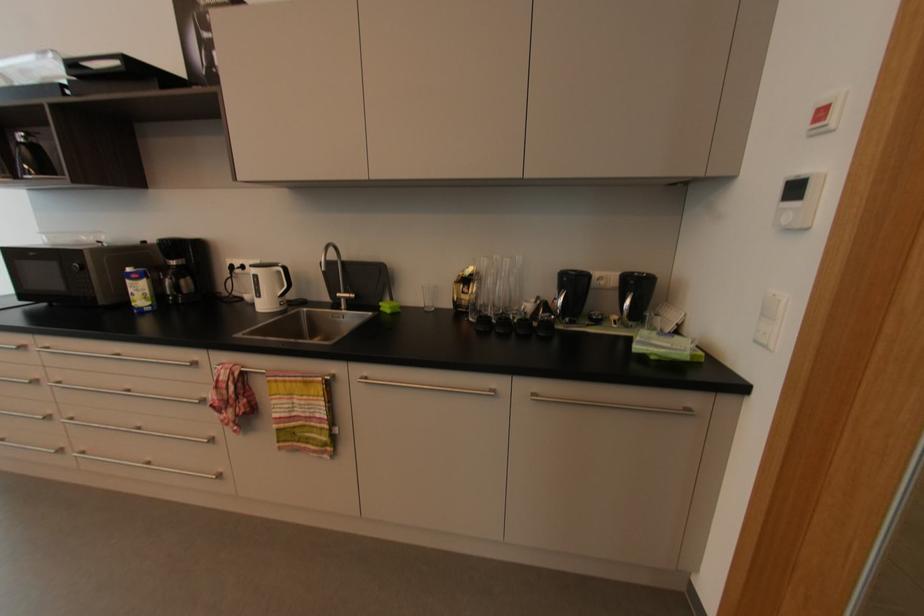
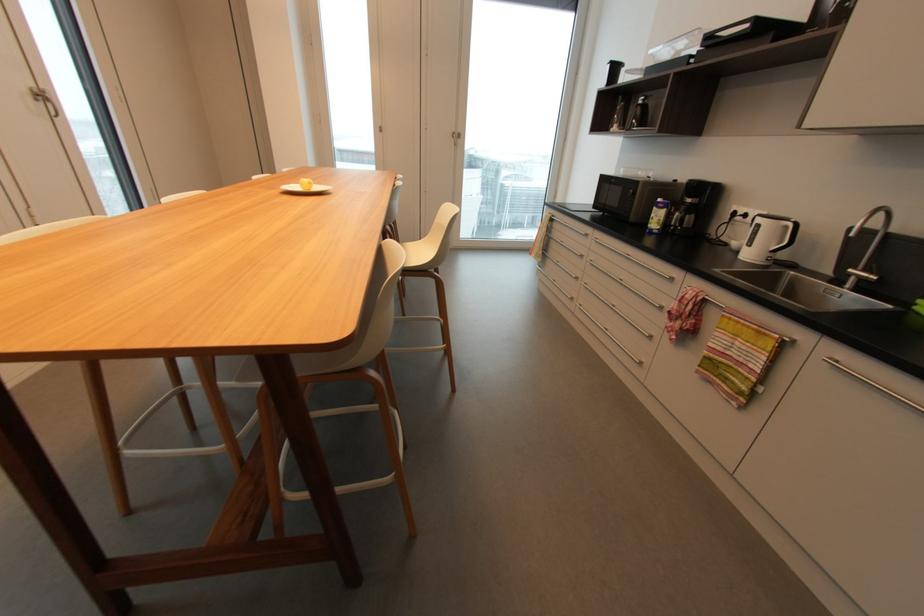
The point at (223, 400) is marked in the first image. Where is the corresponding point in the second image?

(681, 310)